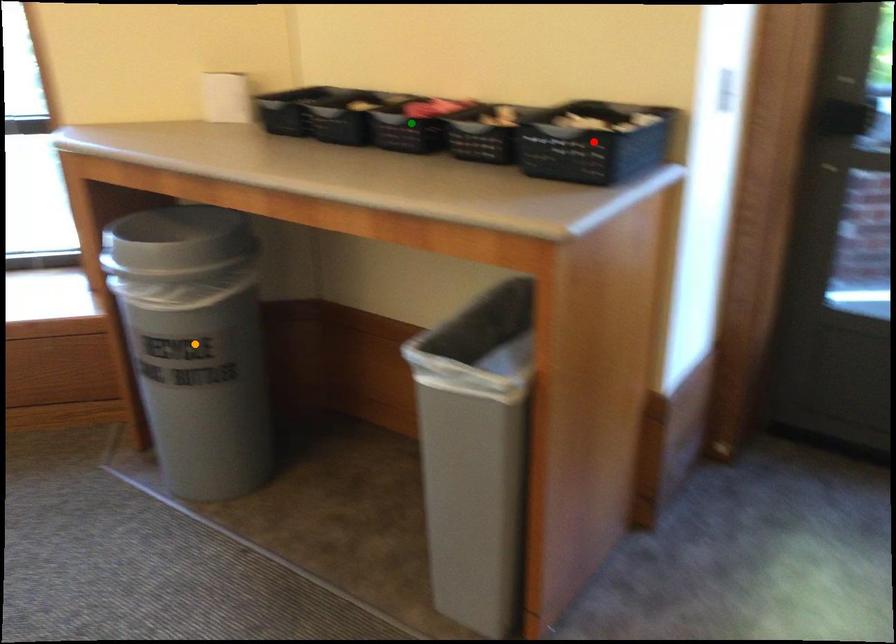
Order these from farthest to nearest:
green point, orange point, red point

orange point, green point, red point